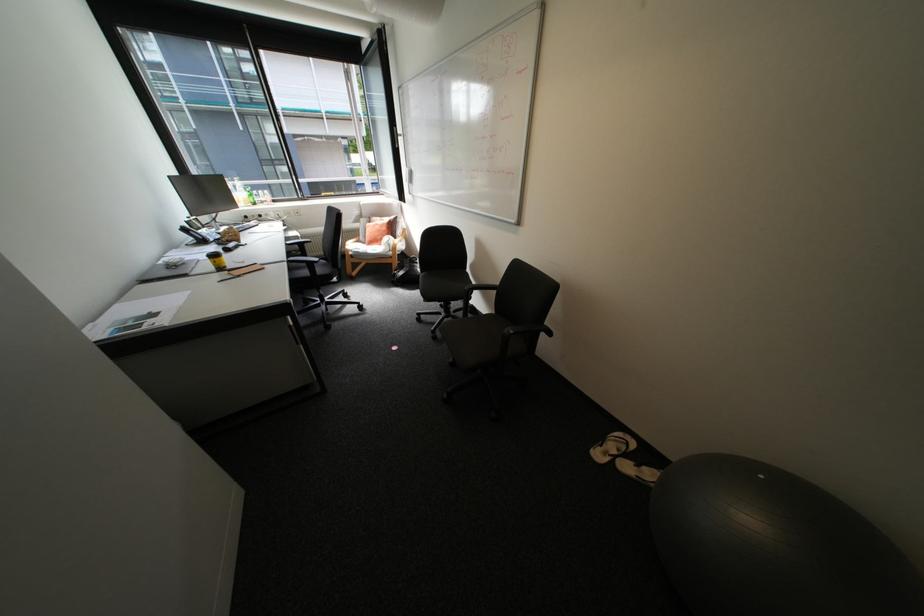
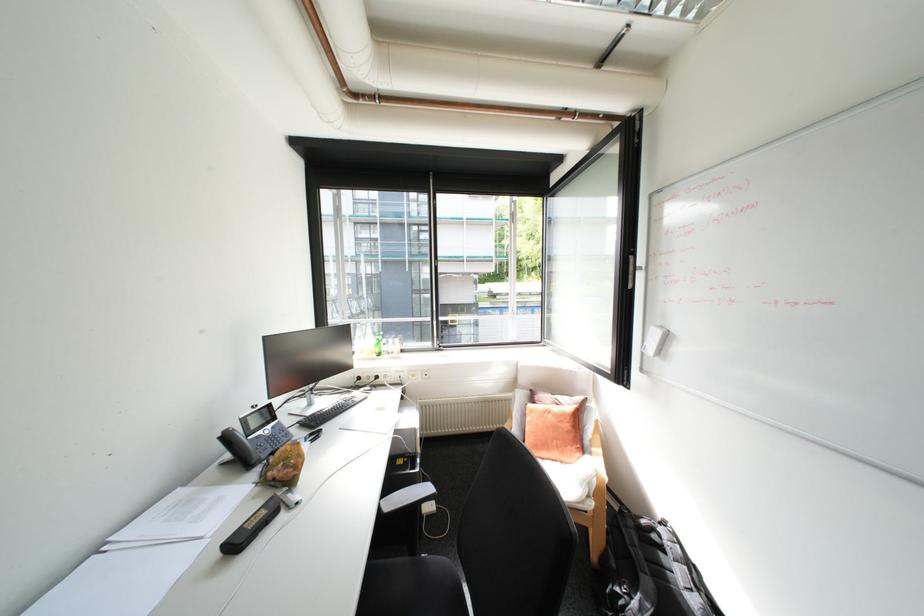
The point at [307,236] is marked in the first image. Where is the corresponding point in the second image?

(424, 429)